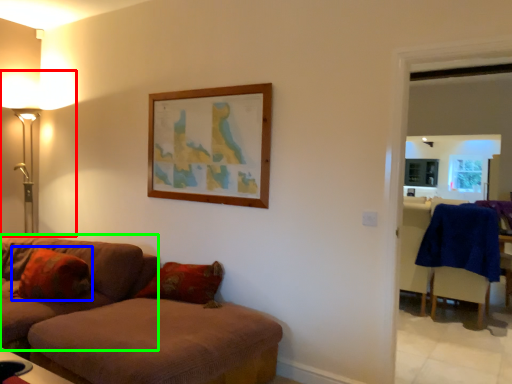
Question: Which object is the closest to the table lamp (highlighted by a red box)? Choose among these: pillow (highlighted by a blue box) or studio couch (highlighted by a green box).

Choices:
 (A) pillow
 (B) studio couch

Answer: (B)